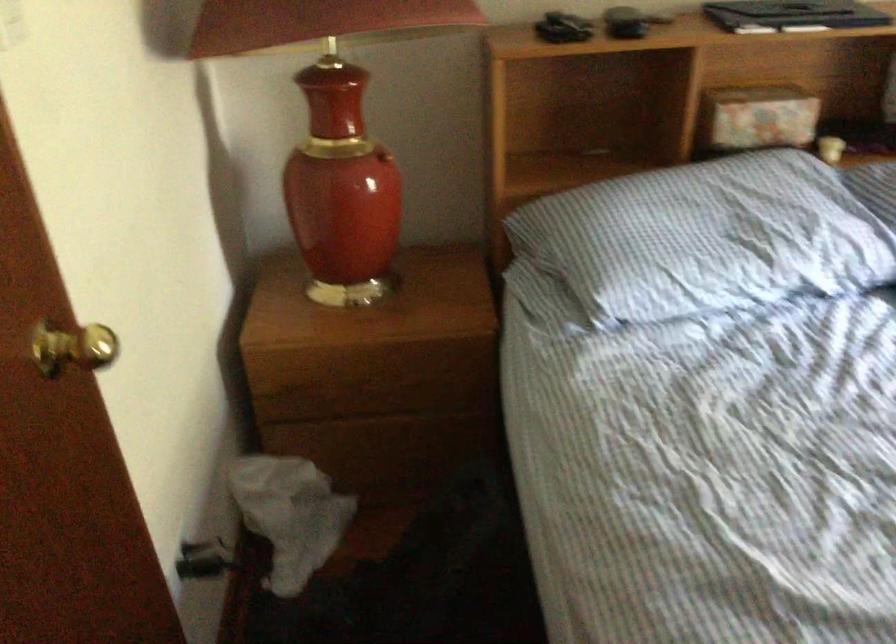
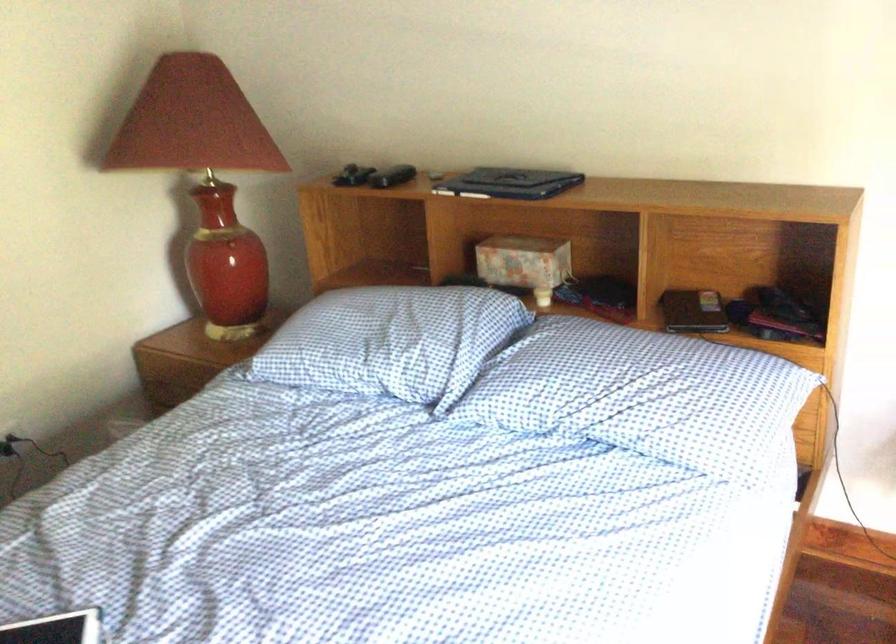
Find the pixel in the second image that matches point (762, 234) in the first image.

(384, 342)